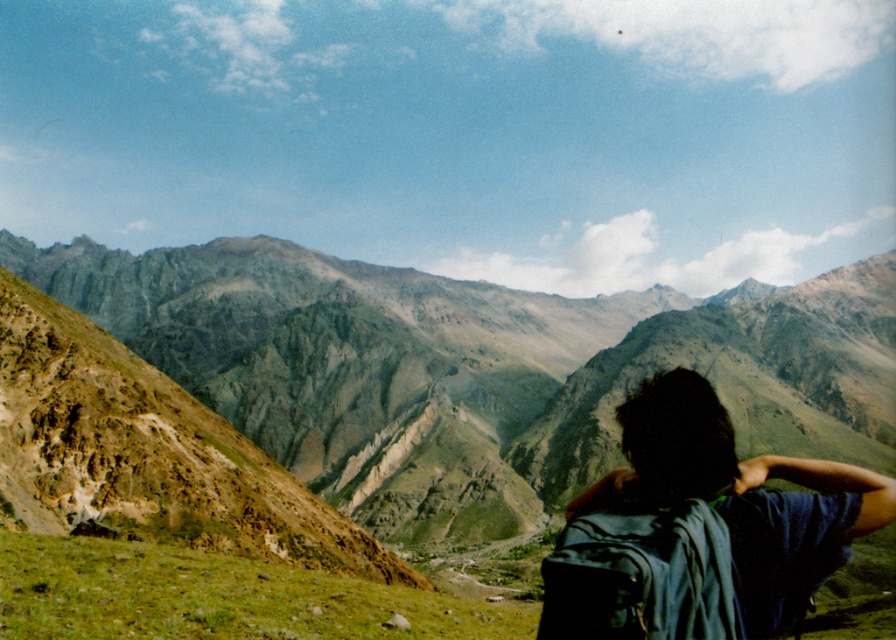
Question: Can you confirm if green rocky mountains at center is bigger than matte black backpack at center?

Choices:
 (A) no
 (B) yes

Answer: (B)

Question: Can you confirm if green rocky mountains at center is smaller than matte black backpack at center?

Choices:
 (A) no
 (B) yes

Answer: (A)

Question: Which object is positioned closest to the dark blue fabric backpack at lower right?

Choices:
 (A) matte black backpack at center
 (B) green rocky mountains at center

Answer: (A)

Question: Which point is closer to the camera?

Choices:
 (A) matte black backpack at center
 (B) dark blue fabric backpack at lower right
 (C) green rocky mountains at center

Answer: (A)

Question: Can you confirm if dark blue fabric backpack at lower right is wider than matte black backpack at center?

Choices:
 (A) yes
 (B) no

Answer: (A)

Question: Which object is farther from the camera taking this photo?

Choices:
 (A) matte black backpack at center
 (B) dark blue fabric backpack at lower right

Answer: (B)